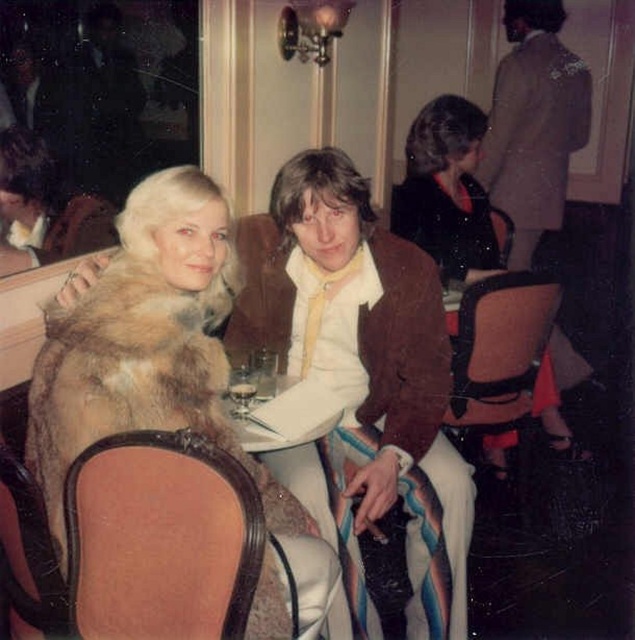
In the scene shown: Is fur coat at left smaller than brown leather jacket at center?

Indeed, fur coat at left has a smaller size compared to brown leather jacket at center.

Does fur coat at left lie behind brown leather jacket at center?

No, it is not.

Where is `fur coat at left`? Image resolution: width=635 pixels, height=640 pixels. fur coat at left is located at coordinates (168, 378).

Where is `fur coat at left`? This screenshot has height=640, width=635. fur coat at left is located at coordinates (168, 378).

Which of these two, brown leather chair at lower left or brown leather chair at center, stands shorter?

With less height is brown leather chair at lower left.

Can you confirm if brown leather chair at lower left is shorter than brown leather chair at center?

Yes, brown leather chair at lower left is shorter than brown leather chair at center.

You are a GUI agent. You are given a task and a screenshot of the screen. Output one action in this format:
    pyautogui.click(x=<x>, y=<y>)
    Task: Click on the brown leather chair at lower left
    
    Given the screenshot: What is the action you would take?
    pyautogui.click(x=161, y=538)

This screenshot has width=635, height=640. Find the location of `brown leather jacket at center`. brown leather jacket at center is located at coordinates (533, 124).

Is brown leather jacket at center taller than velvet black dress at center?

Yes.

Is point (535, 397) farther from viewer compared to point (478, 275)?

Yes, point (535, 397) is behind point (478, 275).

The image size is (635, 640). I want to click on brown leather jacket at center, so click(533, 124).